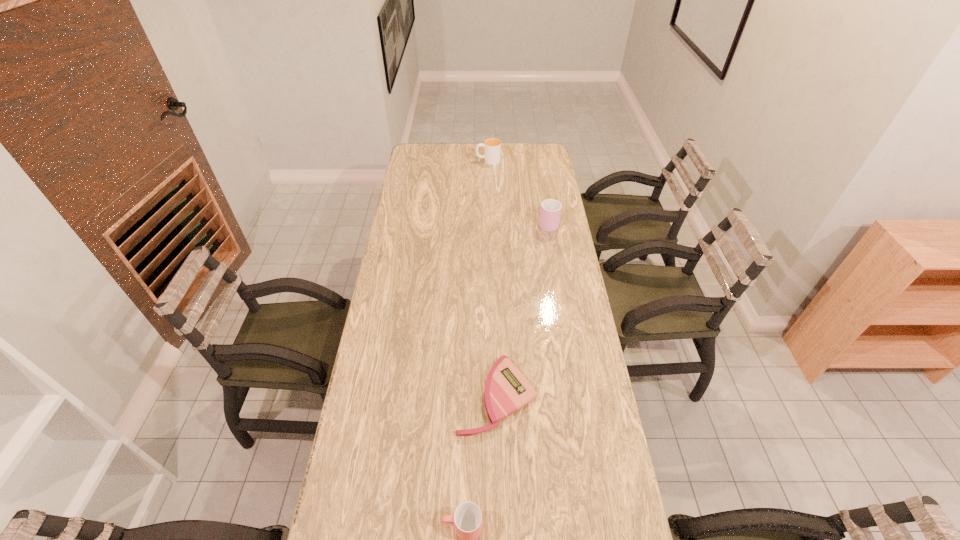
Image resolution: width=960 pixels, height=540 pixels. In order to click on vacant space situated with the handle on the side of the farthest cup in this screenshot , I will do (x=431, y=160).

The width and height of the screenshot is (960, 540). Identify the location of blank area located on the left of the wristlet. (384, 395).

Locate an element on the screen. This screenshot has width=960, height=540. object at the far edge is located at coordinates (492, 146).

At what (x,y) coordinates should I click in order to perform the action: click on object at the right edge. Please return your answer as a coordinate pair (x, y). The height and width of the screenshot is (540, 960). Looking at the image, I should click on [550, 212].

Locate an element on the screen. free space at the far edge of the desktop is located at coordinates (448, 162).

This screenshot has height=540, width=960. In the image, there is a desktop. Identify the location of vacant space at the left edge. [401, 375].

The height and width of the screenshot is (540, 960). In order to click on free space at the right edge of the desktop in this screenshot , I will do `click(534, 215)`.

Locate an element on the screen. The width and height of the screenshot is (960, 540). vacant space at the far left corner of the desktop is located at coordinates point(410,148).

Where is `free point between the second nearest object and the second farthest object`? The height and width of the screenshot is (540, 960). free point between the second nearest object and the second farthest object is located at coordinates (522, 309).

This screenshot has width=960, height=540. I want to click on free space between the farthest cup and the third farthest object, so click(492, 278).